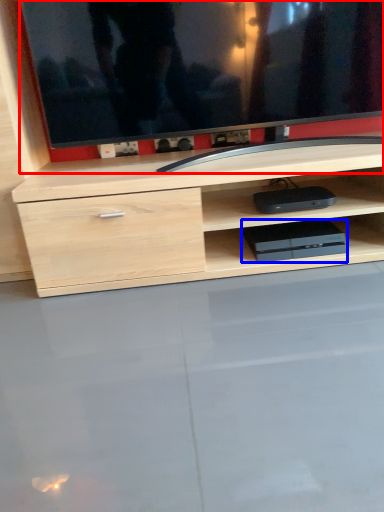
Question: Which object appears closest to the camera in this image, television (highlighted by a red box) or equipment (highlighted by a blue box)?

Choices:
 (A) television
 (B) equipment

Answer: (A)